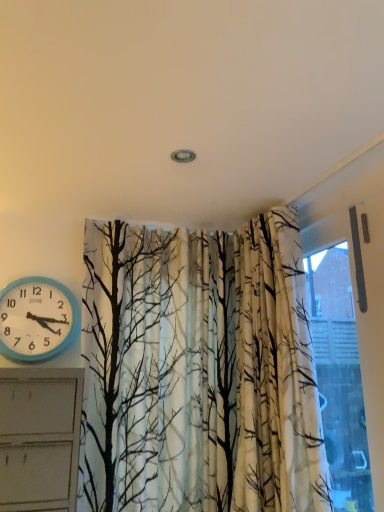
Question: In the image, is transparent glass window at upper right positioned in front of or behind blue plastic wall clock at left?

Choices:
 (A) front
 (B) behind

Answer: (A)

Question: Considering the positions of transparent glass window at upper right and blue plastic wall clock at left in the image, is transparent glass window at upper right bigger or smaller than blue plastic wall clock at left?

Choices:
 (A) big
 (B) small

Answer: (A)

Question: Considering the positions of transparent glass window at upper right and blue plastic wall clock at left in the image, is transparent glass window at upper right taller or shorter than blue plastic wall clock at left?

Choices:
 (A) short
 (B) tall

Answer: (B)

Question: Considering the relative positions of blue plastic wall clock at left and transparent glass window at upper right in the image provided, is blue plastic wall clock at left to the left or to the right of transparent glass window at upper right?

Choices:
 (A) left
 (B) right

Answer: (A)

Question: From a real-world perspective, relative to transparent glass window at upper right, is blue plastic wall clock at left vertically above or below?

Choices:
 (A) above
 (B) below

Answer: (A)

Question: Is blue plastic wall clock at left in front of or behind transparent glass window at upper right in the image?

Choices:
 (A) behind
 (B) front

Answer: (A)

Question: Is blue plastic wall clock at left wider or thinner than transparent glass window at upper right?

Choices:
 (A) wide
 (B) thin

Answer: (A)